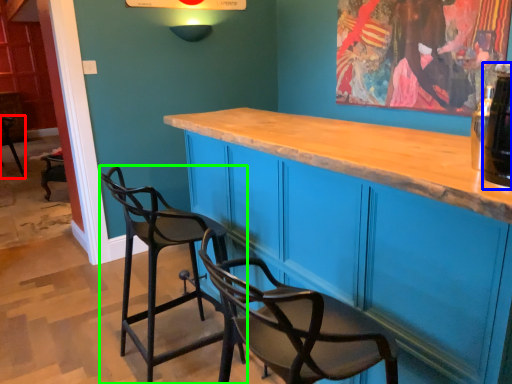
Question: Which is nearer to the chair (highlighted by a red box)? beverage (highlighted by a blue box) or chair (highlighted by a green box).

Choices:
 (A) beverage
 (B) chair

Answer: (B)